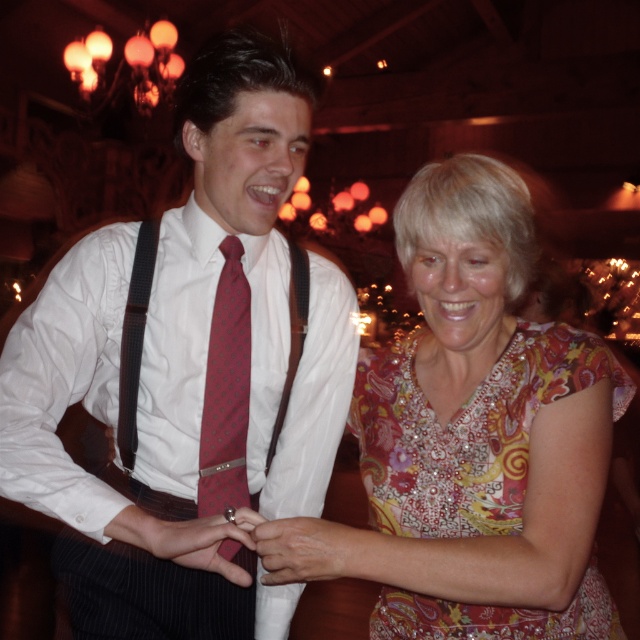
Question: Does metallic ring at center have a smaller size compared to smooth skin hand at center?

Choices:
 (A) no
 (B) yes

Answer: (B)

Question: Considering the real-world distances, which object is farthest from the polka dot silk tie at center?

Choices:
 (A) smooth skin hand at center
 (B) metallic ring at center
 (C) floral-patterned fabric dress at lower right

Answer: (C)

Question: Which of the following is the farthest from the observer?

Choices:
 (A) matte red tie at center
 (B) floral-patterned dress at center
 (C) smooth skin hand at center

Answer: (A)

Question: Does floral-patterned fabric dress at lower right come in front of polka dot silk tie at center?

Choices:
 (A) yes
 (B) no

Answer: (A)

Question: Does metallic ring at center appear on the right side of smooth skin hand at center?

Choices:
 (A) yes
 (B) no

Answer: (B)

Question: Which point is farther to the camera?

Choices:
 (A) floral-patterned dress at center
 (B) matte red tie at center
 (C) polka dot silk tie at center
 (D) metallic ring at center

Answer: (C)